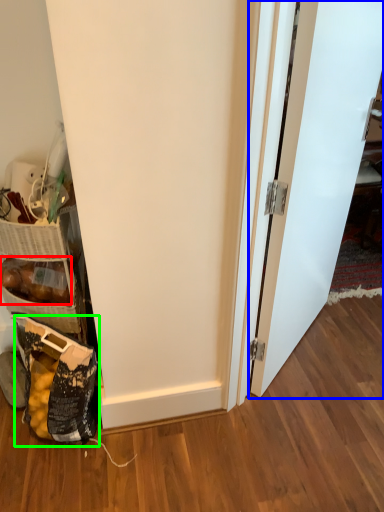
Question: Based on their relative distances, which object is farther from stuff (highlighted by a red box)? Choose from door (highlighted by a blue box) and material (highlighted by a green box).

Choices:
 (A) door
 (B) material

Answer: (A)